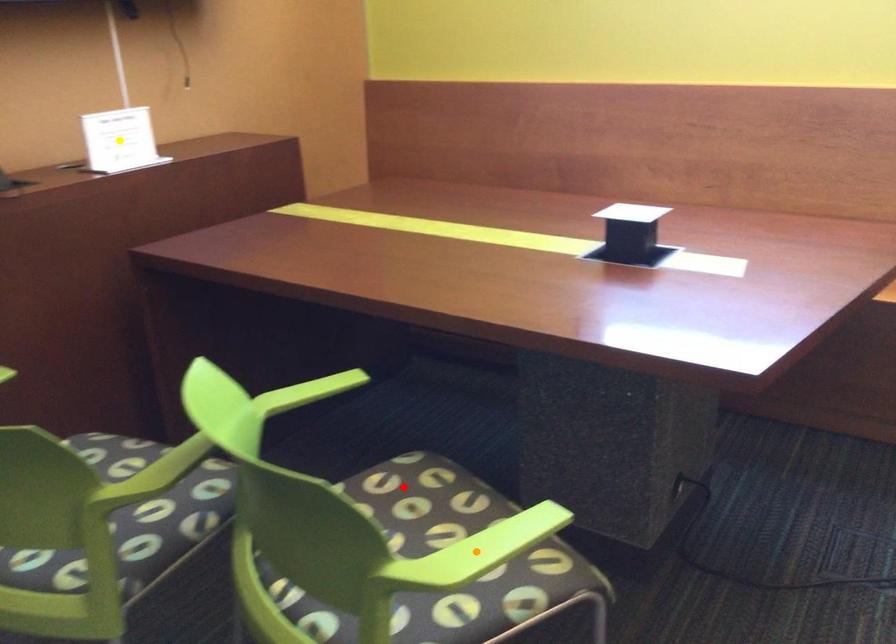
Order these from farthest to nearest:
orange point, yellow point, red point

yellow point → red point → orange point